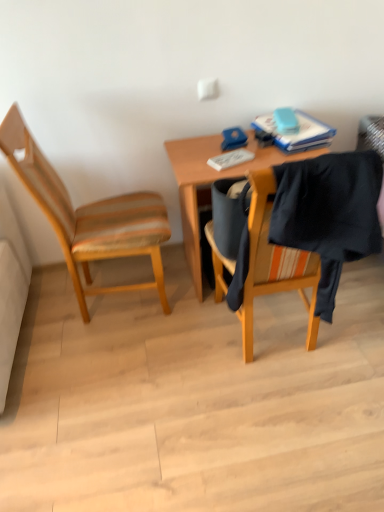
Question: Can we say blue matte book at upper right lies outside wooden desk at center?

Choices:
 (A) yes
 (B) no

Answer: (B)

Question: Is the depth of blue matte book at upper right less than that of wooden desk at center?

Choices:
 (A) yes
 (B) no

Answer: (B)

Question: From a real-world perspective, is blue matte book at upper right on wooden desk at center?

Choices:
 (A) no
 (B) yes

Answer: (B)

Question: Considering the relative sizes of blue matte book at upper right and wooden desk at center in the image provided, is blue matte book at upper right bigger than wooden desk at center?

Choices:
 (A) no
 (B) yes

Answer: (A)

Question: Is blue matte book at upper right positioned with its back to wooden desk at center?

Choices:
 (A) no
 (B) yes

Answer: (A)

Question: Is wooden chair at left bigger or smaller than black fabric at right?

Choices:
 (A) big
 (B) small

Answer: (A)

Question: Visually, is wooden chair at left positioned to the left or to the right of black fabric at right?

Choices:
 (A) left
 (B) right

Answer: (A)

Question: In terms of width, does wooden chair at left look wider or thinner when compared to black fabric at right?

Choices:
 (A) wide
 (B) thin

Answer: (A)

Question: In terms of height, does wooden chair at left look taller or shorter compared to black fabric at right?

Choices:
 (A) tall
 (B) short

Answer: (A)

Question: Does point (91, 259) appear closer or farther from the camera than point (200, 158)?

Choices:
 (A) closer
 (B) farther

Answer: (A)

Question: Relative to wooden desk at center, is wooden chair at left in front or behind?

Choices:
 (A) front
 (B) behind

Answer: (A)

Question: From their relative heights in the image, would you say wooden chair at left is taller or shorter than wooden desk at center?

Choices:
 (A) short
 (B) tall

Answer: (B)

Question: Which is correct: wooden chair at left is inside wooden desk at center, or outside of it?

Choices:
 (A) inside
 (B) outside

Answer: (B)

Question: Is wooden desk at center spatially inside blue matte book at upper right, or outside of it?

Choices:
 (A) inside
 (B) outside

Answer: (B)

Question: Considering their positions, is wooden desk at center located in front of or behind blue matte book at upper right?

Choices:
 (A) front
 (B) behind

Answer: (A)